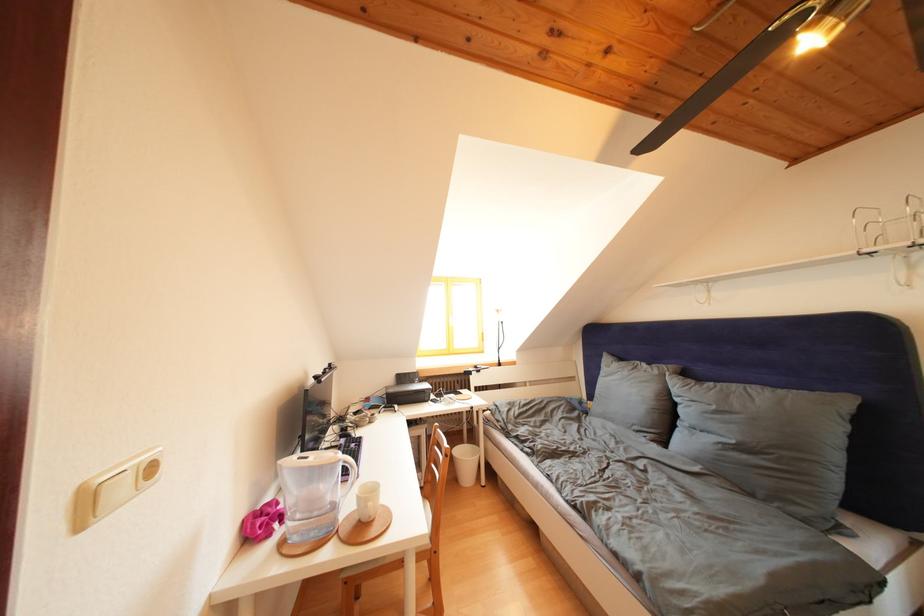
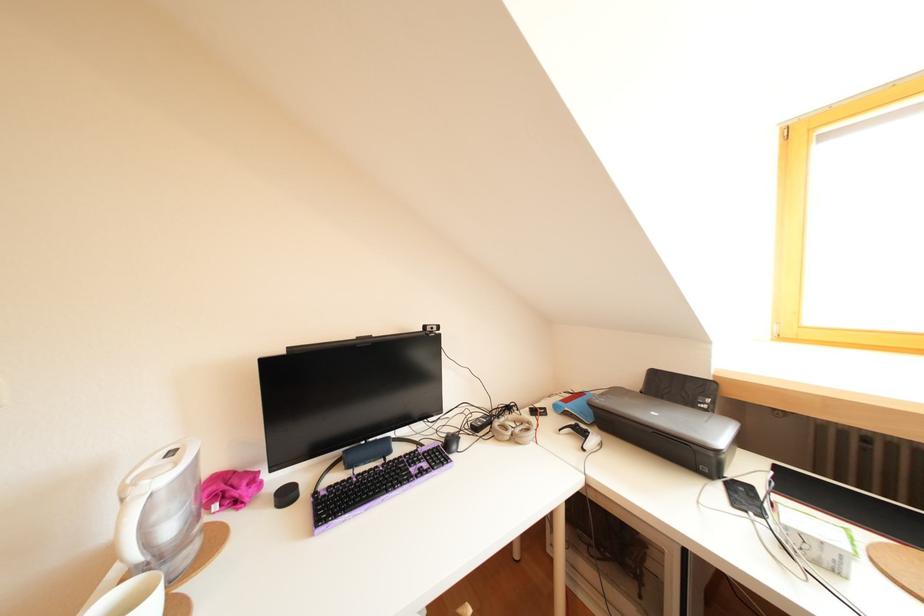
Locate, in the second image, the point that corresponds to (x=438, y=408) in the first image.

(727, 490)